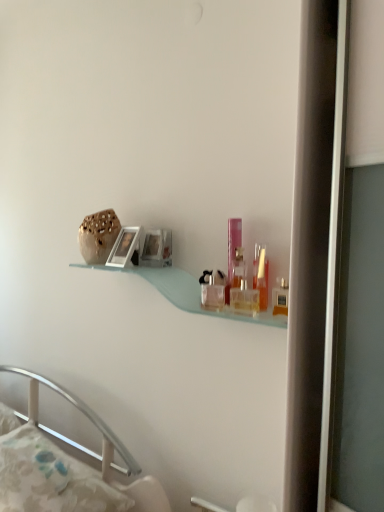
Question: Does white glossy picture frame at upper center appear on the left side of white fabric pillow at lower left?

Choices:
 (A) no
 (B) yes

Answer: (A)

Question: From the image's perspective, does white glossy picture frame at upper center appear higher than white fabric pillow at lower left?

Choices:
 (A) no
 (B) yes

Answer: (B)

Question: Is white glossy picture frame at upper center bigger than white fabric pillow at lower left?

Choices:
 (A) yes
 (B) no

Answer: (B)

Question: Can white fabric pillow at lower left be found inside white glossy picture frame at upper center?

Choices:
 (A) yes
 (B) no

Answer: (B)

Question: From a real-world perspective, is white glossy picture frame at upper center physically below white fabric pillow at lower left?

Choices:
 (A) yes
 (B) no

Answer: (B)

Question: Is point (120, 252) closer or farther from the camera than point (284, 296)?

Choices:
 (A) closer
 (B) farther

Answer: (B)

Question: Do you think white glossy picture frame at upper center is within matte plastic toiletry at right, placed as the 4th toiletry when sorted from left to right, or outside of it?

Choices:
 (A) outside
 (B) inside

Answer: (A)

Question: From the image's perspective, is white glossy picture frame at upper center positioned above or below matte plastic toiletry at right, which is counted as the 1th toiletry, starting from the right?

Choices:
 (A) above
 (B) below

Answer: (A)

Question: Is white glossy picture frame at upper center to the left or to the right of matte plastic toiletry at right, arranged as the 4th toiletry when viewed from the back, in the image?

Choices:
 (A) right
 (B) left

Answer: (B)

Question: Choose the correct answer: Is white glossy picture frame at upper center inside translucent glass perfume bottle at upper right, marked as the second toiletry in a front-to-back arrangement, or outside it?

Choices:
 (A) outside
 (B) inside

Answer: (A)

Question: Based on their positions, is white glossy picture frame at upper center located to the left or right of translucent glass perfume bottle at upper right, which appears as the third toiletry when viewed from the left?

Choices:
 (A) left
 (B) right

Answer: (A)

Question: Is point (135, 233) closer or farther from the camera than point (264, 252)?

Choices:
 (A) farther
 (B) closer

Answer: (A)

Question: From a real-world perspective, is white glossy picture frame at upper center physically located above or below translucent glass perfume bottle at upper right, which appears as the third toiletry when viewed from the left?

Choices:
 (A) above
 (B) below

Answer: (A)

Question: Looking at their shapes, would you say clear glass perfume bottles at center, which appears as the second toiletry when viewed from the back, is wider or thinner than pink plastic perfume at center, which is counted as the fourth toiletry, starting from the front?

Choices:
 (A) wide
 (B) thin

Answer: (A)

Question: Which is correct: clear glass perfume bottles at center, which appears as the second toiletry when viewed from the back, is inside pink plastic perfume at center, which is counted as the second toiletry, starting from the left, or outside of it?

Choices:
 (A) outside
 (B) inside

Answer: (A)